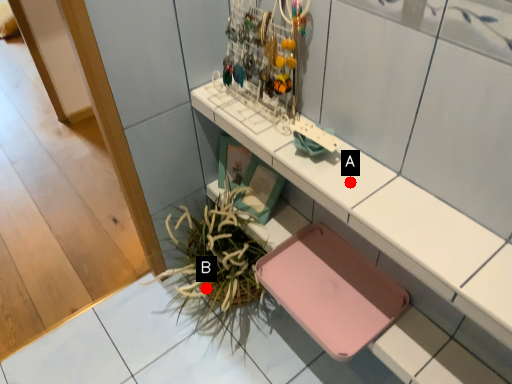
Question: Two points are circled on the image, labeled by A and B beside each circle. Which point is farther from the camera taking this photo?

Choices:
 (A) A is further
 (B) B is further

Answer: (B)